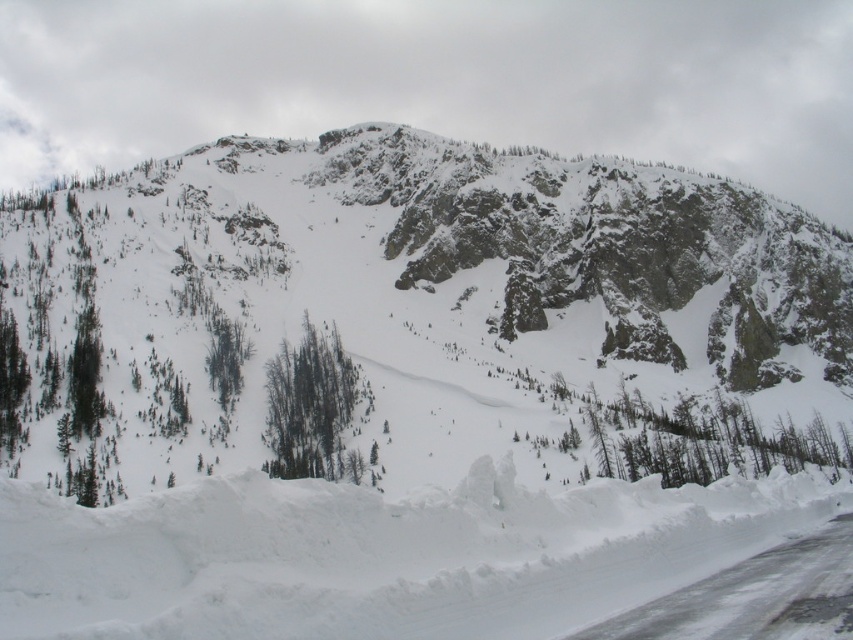
You are an outdoor adventurer planning to hike through the snow at center. You see the white snow at center and the green matte trees at center. Which one is taller?

The green matte trees at center are taller than the white snow at center.

You are a hiker planning to take a photo of the white rocky mountain at center and the green matte trees at center. Which object should you focus on first to ensure both are in clear view?

You should focus on the white rocky mountain at center first because it is closer to you than the green matte trees at center, so adjusting focus from near to far will help both be in clear view.

You are a hiker planning to cross the snowfield between the white snow at center and the green matte trees at center. Your GPS says you have a battery that can last for a 70 meter hike. Do you think you can make it to the trees without running out of battery?

The distance between the white snow at center and the green matte trees at center is 62.48 meters, so yes, the hiker can make it to the trees without running out of battery since the distance is less than the 70 meter range provided by the GPS.